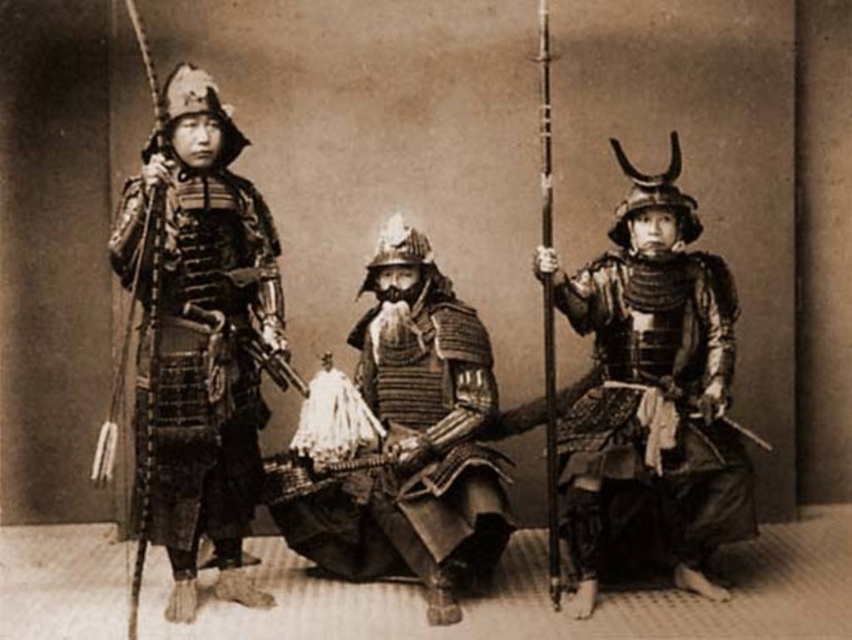
Question: Can you confirm if shiny silver armor at right is smaller than shiny metallic armor at center?

Choices:
 (A) yes
 (B) no

Answer: (A)

Question: Can you confirm if shiny silver armor at right is positioned to the right of shiny metallic armor at center?

Choices:
 (A) no
 (B) yes

Answer: (B)

Question: Among these points, which one is nearest to the camera?

Choices:
 (A) (711, 468)
 (B) (332, 513)
 (C) (252, 296)

Answer: (A)

Question: Which object is the closest to the shiny silver armor at right?

Choices:
 (A) shiny metallic armor at center
 (B) polished metal armor at left

Answer: (A)

Question: Which object appears farthest from the camera in this image?

Choices:
 (A) shiny silver armor at right
 (B) shiny metallic armor at center
 (C) polished metal armor at left

Answer: (A)

Question: Does shiny silver armor at right lie behind shiny metallic armor at center?

Choices:
 (A) no
 (B) yes

Answer: (B)